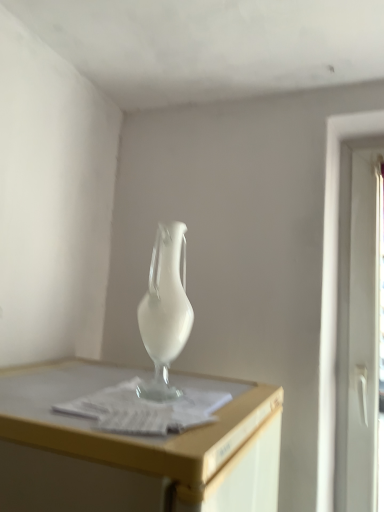
Find the location of a particular element. free space above white paper at center (from a real-world perspective) is located at coordinates (152, 393).